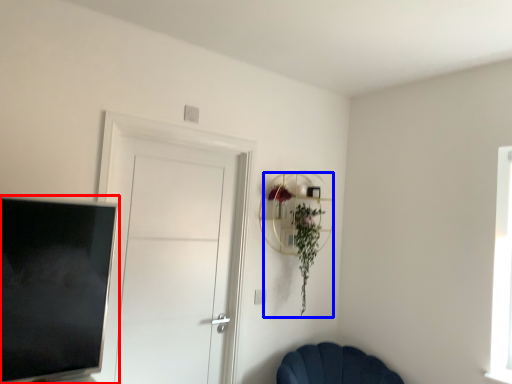
Question: Which object appears closest to the camera in this image, television (highlighted by a red box) or floral arrangement (highlighted by a blue box)?

Choices:
 (A) television
 (B) floral arrangement

Answer: (A)